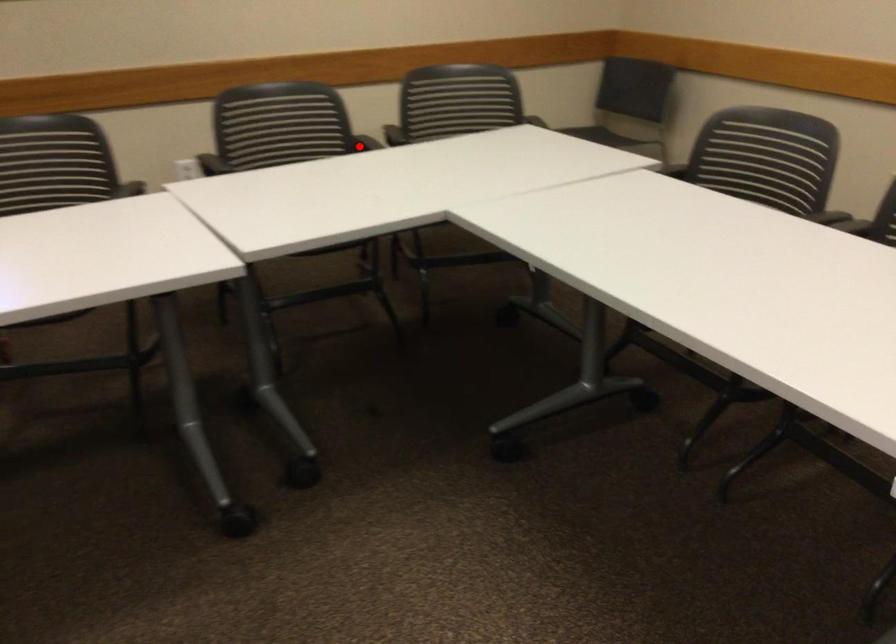
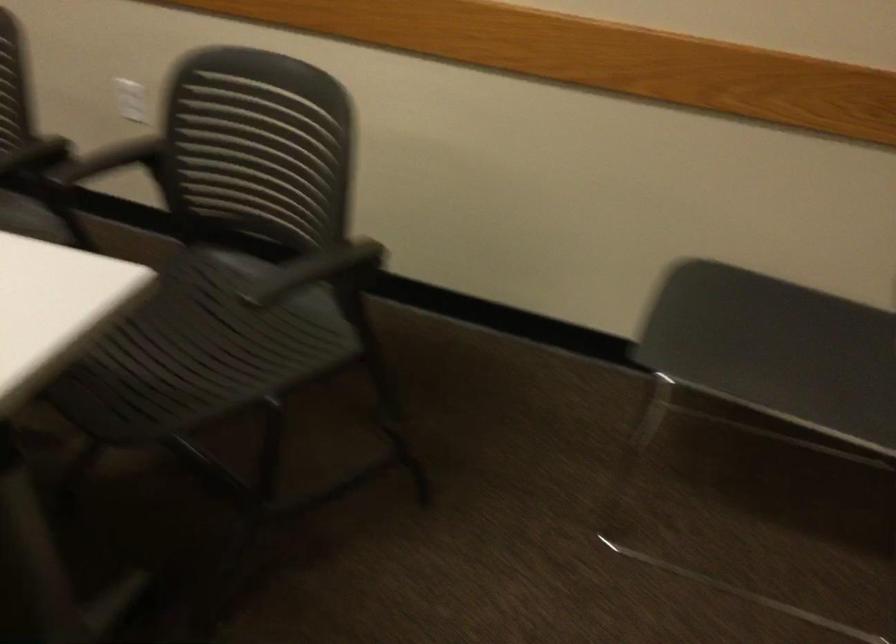
Find the pixel in the second image that matches the highlighted location in the first image.

(35, 156)